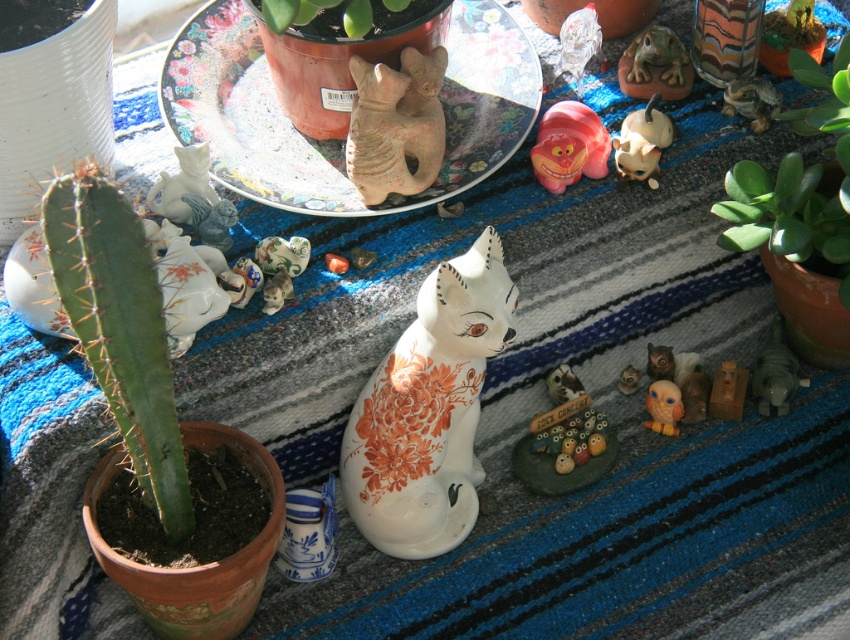
Does rubberized plastic toy at center appear on the right side of green matte plant at upper center?

Indeed, rubberized plastic toy at center is positioned on the right side of green matte plant at upper center.

Who is positioned more to the left, rubberized plastic toy at center or green matte plant at upper center?

green matte plant at upper center is more to the left.

Describe the element at coordinates (570, 145) in the screenshot. I see `rubberized plastic toy at center` at that location.

In order to click on rubberized plastic toy at center in this screenshot , I will do `click(570, 145)`.

Which is more to the right, green rubber plant at upper right or matte clay cat at center?

From the viewer's perspective, green rubber plant at upper right appears more on the right side.

The height and width of the screenshot is (640, 850). What do you see at coordinates (799, 182) in the screenshot? I see `green rubber plant at upper right` at bounding box center [799, 182].

Who is more forward, (822, 84) or (395, 131)?

Point (395, 131) is more forward.

Where is `green rubber plant at upper right`? green rubber plant at upper right is located at coordinates (799, 182).

Is green rubber plant at upper right bigger than green matte frog at upper right?

Indeed, green rubber plant at upper right has a larger size compared to green matte frog at upper right.

Can you confirm if green rubber plant at upper right is thinner than green matte frog at upper right?

No.

Where is `green rubber plant at upper right`? green rubber plant at upper right is located at coordinates (799, 182).